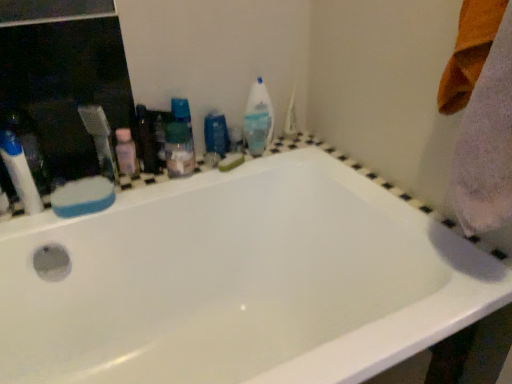
Question: Is white plastic toothbrush at left oriented away from pink plastic bottle at upper left, the second toiletry positioned from the front?

Choices:
 (A) no
 (B) yes

Answer: (A)

Question: Does white plastic toothbrush at left have a greater width compared to pink plastic bottle at upper left, which is the 1th toiletry from right to left?

Choices:
 (A) no
 (B) yes

Answer: (B)

Question: From a real-world perspective, is white plastic toothbrush at left physically above pink plastic bottle at upper left, the second toiletry viewed from the left?

Choices:
 (A) yes
 (B) no

Answer: (A)

Question: From the image's perspective, is white plastic toothbrush at left beneath pink plastic bottle at upper left, the second toiletry positioned from the front?

Choices:
 (A) yes
 (B) no

Answer: (B)

Question: From a real-world perspective, is white plastic toothbrush at left under pink plastic bottle at upper left, the second toiletry positioned from the front?

Choices:
 (A) no
 (B) yes

Answer: (A)

Question: From a real-world perspective, relative to blue glossy mouthwash at center, placed as the first mouthwash when sorted from right to left, is translucent plastic spray bottle at upper center vertically above or below?

Choices:
 (A) above
 (B) below

Answer: (A)

Question: Would you say translucent plastic spray bottle at upper center is inside or outside blue glossy mouthwash at center, placed as the first mouthwash when sorted from right to left?

Choices:
 (A) inside
 (B) outside

Answer: (B)

Question: Considering the positions of translucent plastic spray bottle at upper center and blue glossy mouthwash at center, which appears as the first mouthwash when viewed from the back, in the image, is translucent plastic spray bottle at upper center bigger or smaller than blue glossy mouthwash at center, which appears as the first mouthwash when viewed from the back,?

Choices:
 (A) big
 (B) small

Answer: (A)

Question: In terms of height, does translucent plastic spray bottle at upper center look taller or shorter compared to blue glossy mouthwash at center, which appears as the first mouthwash when viewed from the back?

Choices:
 (A) tall
 (B) short

Answer: (A)

Question: Looking at their shapes, would you say blue glossy mouthwash at center, which appears as the first mouthwash when viewed from the back, is wider or thinner than translucent plastic spray bottle at upper center?

Choices:
 (A) wide
 (B) thin

Answer: (B)

Question: Considering the positions of blue glossy mouthwash at center, which appears as the 2th mouthwash when viewed from the left, and translucent plastic spray bottle at upper center in the image, is blue glossy mouthwash at center, which appears as the 2th mouthwash when viewed from the left, bigger or smaller than translucent plastic spray bottle at upper center?

Choices:
 (A) big
 (B) small

Answer: (B)

Question: Is point (206, 147) closer or farther from the camera than point (247, 142)?

Choices:
 (A) farther
 (B) closer

Answer: (B)

Question: Is blue glossy mouthwash at center, placed as the first mouthwash when sorted from right to left, inside or outside of translucent plastic spray bottle at upper center?

Choices:
 (A) inside
 (B) outside

Answer: (B)

Question: Is white glossy bathtub at center inside the boundaries of translucent plastic spray bottle at upper center, or outside?

Choices:
 (A) inside
 (B) outside

Answer: (B)

Question: From their relative heights in the image, would you say white glossy bathtub at center is taller or shorter than translucent plastic spray bottle at upper center?

Choices:
 (A) short
 (B) tall

Answer: (B)